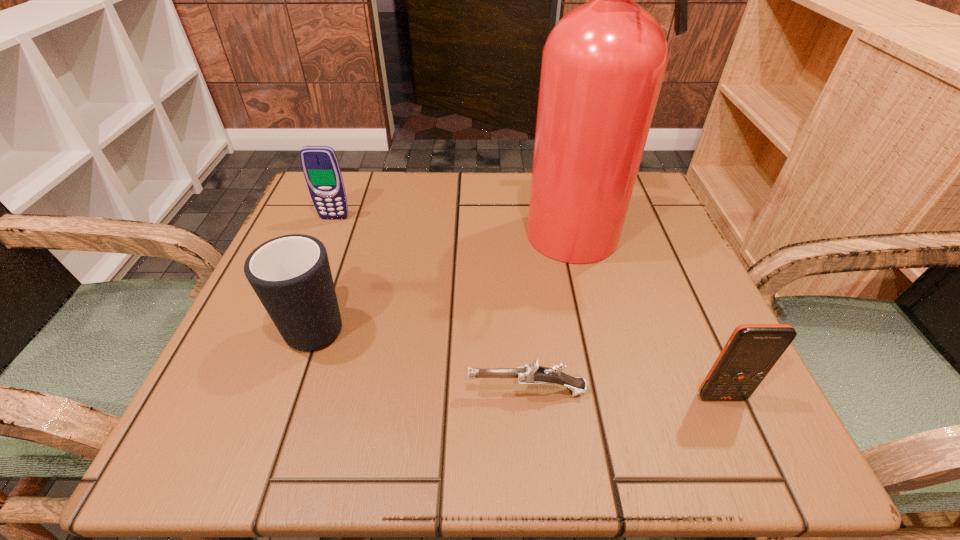
Locate an element on the screen. Image resolution: width=960 pixels, height=540 pixels. unoccupied area between the left cellular telephone and the shortest object is located at coordinates click(431, 305).

Find the location of a particular element. free space between the third farthest object and the fire extinguisher is located at coordinates (454, 278).

In order to click on free point between the tallest object and the left cellular telephone in this screenshot , I will do `click(463, 227)`.

In order to click on unoccupied area between the left cellular telephone and the nearer cellular telephone in this screenshot , I will do click(x=528, y=307).

At what (x,y) coordinates should I click in order to perform the action: click on vacant region between the gun and the left cellular telephone. Please return your answer as a coordinate pair (x, y). The height and width of the screenshot is (540, 960). Looking at the image, I should click on (431, 305).

At what (x,y) coordinates should I click in order to perform the action: click on vacant area that lies between the right cellular telephone and the third nearest object. Please return your answer as a coordinate pair (x, y). This screenshot has width=960, height=540. Looking at the image, I should click on (520, 359).

The height and width of the screenshot is (540, 960). What are the coordinates of `vacant space that is in between the shortest object and the tallest object` in the screenshot? It's located at pyautogui.click(x=559, y=313).

What are the coordinates of `free space between the gun and the tallest object` in the screenshot? It's located at (559, 313).

The image size is (960, 540). What are the coordinates of `free area in between the shortest object and the fire extinguisher` in the screenshot? It's located at (559, 313).

What are the coordinates of `blank region between the farther cellular telephone and the fire extinguisher` in the screenshot? It's located at (463, 227).